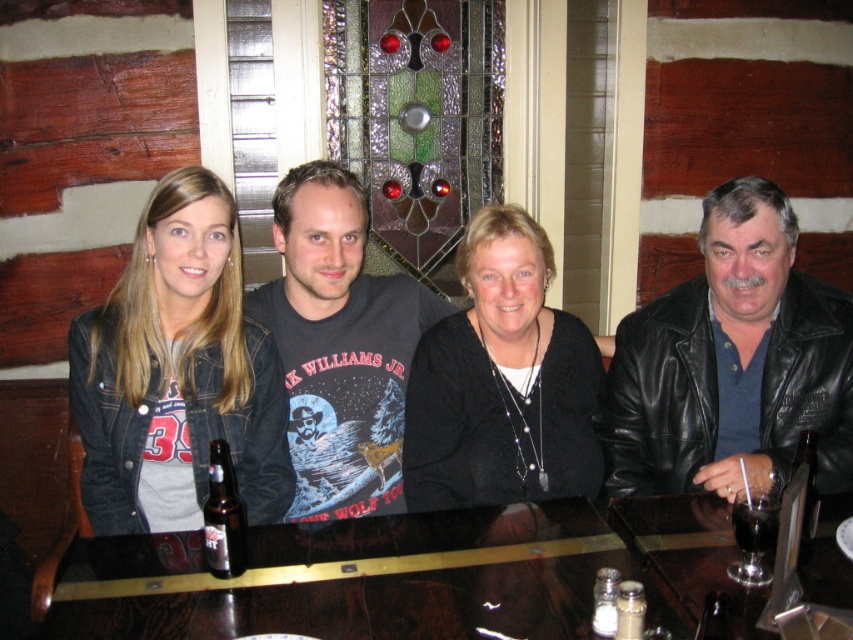
Question: Which point is closer to the camera?

Choices:
 (A) dark gray t-shirt at center
 (B) shiny dark wood table at center
 (C) black leather jacket at right

Answer: (B)

Question: Is black leather jacket at right thinner than denim jacket at left?

Choices:
 (A) no
 (B) yes

Answer: (A)

Question: Does black matte sweater at center have a larger size compared to dark glass cup at lower right?

Choices:
 (A) no
 (B) yes

Answer: (B)

Question: Which point is closer to the camera?

Choices:
 (A) (581, 472)
 (B) (624, 353)

Answer: (A)

Question: Does denim jacket at left appear over dark gray t-shirt at center?

Choices:
 (A) no
 (B) yes

Answer: (A)

Question: Estimate the real-world distances between objects in this image. Which object is closer to the dark gray t-shirt at center?

Choices:
 (A) black matte sweater at center
 (B) black leather jacket at right
 (C) shiny dark wood table at center

Answer: (A)